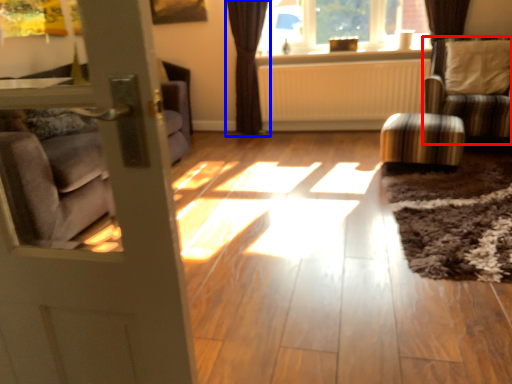
Question: Which object is further to the camera taking this photo, chair (highlighted by a red box) or curtain (highlighted by a blue box)?

Choices:
 (A) chair
 (B) curtain

Answer: (B)